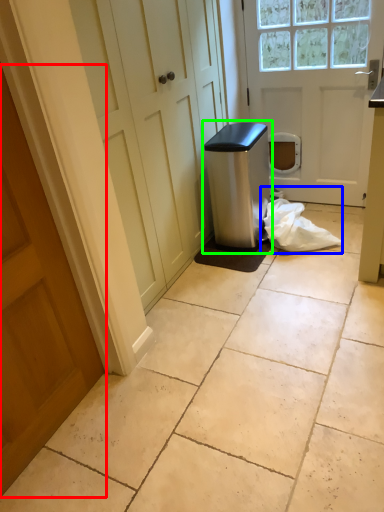
Question: Based on their relative distances, which object is nearer to door (highlighted by a red box)? Choose from material (highlighted by a blue box) and water cooler (highlighted by a green box).

Choices:
 (A) material
 (B) water cooler

Answer: (B)